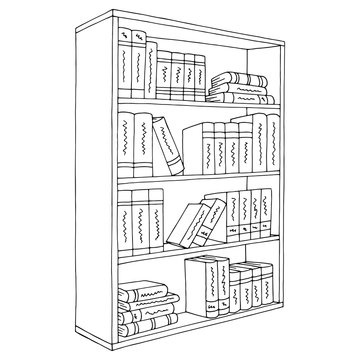
I want to click on second shelf from the top books, so click(120, 158), click(138, 156), click(168, 150), click(208, 161), click(220, 158), click(231, 158), click(244, 159), click(275, 154), click(258, 155).